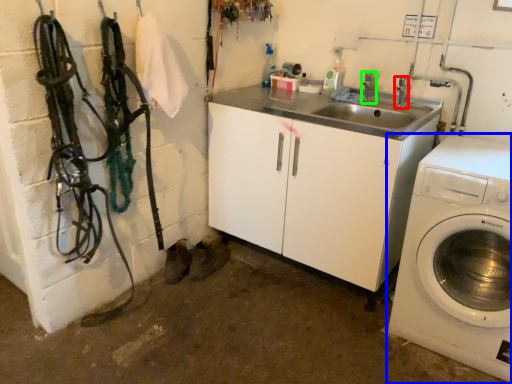
Question: Which object is positioned closest to faucet (highlighted by a red box)? Select from washing machine (highlighted by a blue box) and faucet (highlighted by a green box).

Choices:
 (A) washing machine
 (B) faucet

Answer: (B)